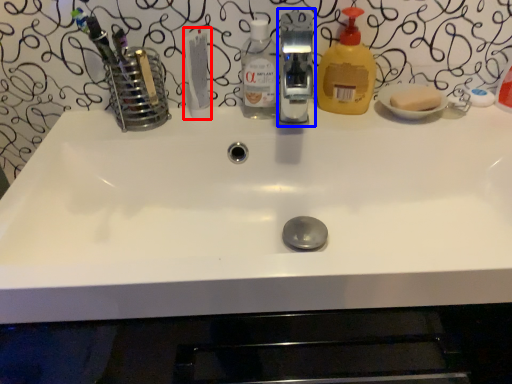
Question: Which point is further to the camera, toothpaste (highlighted by a red box) or fixture (highlighted by a blue box)?

Choices:
 (A) toothpaste
 (B) fixture

Answer: (A)